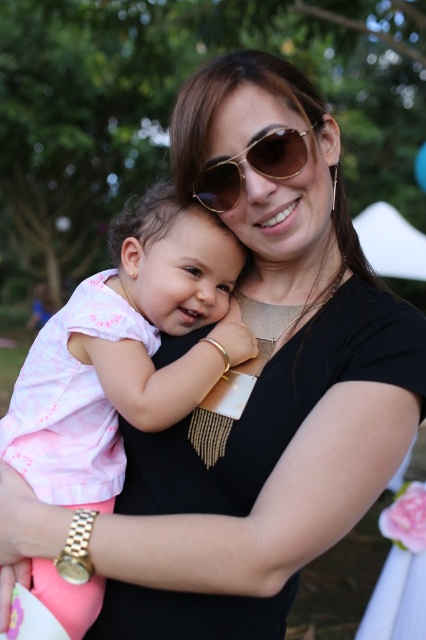
Question: Is pink cotton shirt at center behind gold metallic sunglasses at center?

Choices:
 (A) yes
 (B) no

Answer: (B)

Question: Is the position of pink cotton shirt at center more distant than that of gold metallic sunglasses at center?

Choices:
 (A) no
 (B) yes

Answer: (A)

Question: Which object is farther from the camera taking this photo?

Choices:
 (A) pink cotton shirt at center
 (B) gold metallic sunglasses at center

Answer: (B)

Question: Which point is closer to the camera?

Choices:
 (A) (219, 316)
 (B) (308, 131)

Answer: (B)

Question: Does pink cotton shirt at center lie behind gold metallic sunglasses at center?

Choices:
 (A) yes
 (B) no

Answer: (B)